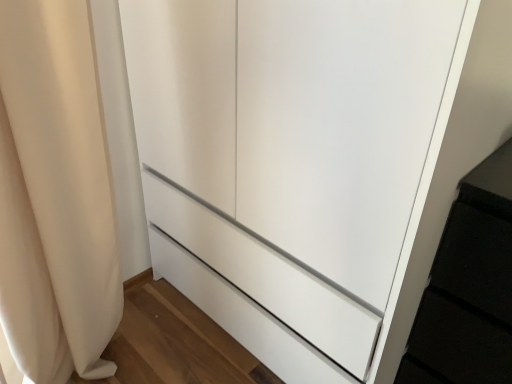
Question: Should I look upward or downward to see white glossy cupboard at center?

Choices:
 (A) down
 (B) up

Answer: (B)

Question: Does beige fabric curtain at left lie behind white glossy cupboard at center?

Choices:
 (A) no
 (B) yes

Answer: (B)

Question: Is beige fabric curtain at left located outside white glossy cupboard at center?

Choices:
 (A) no
 (B) yes

Answer: (B)

Question: Is beige fabric curtain at left at the left side of white glossy cupboard at center?

Choices:
 (A) no
 (B) yes

Answer: (B)

Question: Is beige fabric curtain at left with white glossy cupboard at center?

Choices:
 (A) yes
 (B) no

Answer: (B)

Question: From the image's perspective, is beige fabric curtain at left on white glossy cupboard at center?

Choices:
 (A) no
 (B) yes

Answer: (A)

Question: Is beige fabric curtain at left aimed at white glossy cupboard at center?

Choices:
 (A) no
 (B) yes

Answer: (A)

Question: Are white glossy cupboard at center and beige fabric curtain at left making contact?

Choices:
 (A) no
 (B) yes

Answer: (A)

Question: From the image's perspective, is white glossy cupboard at center on beige fabric curtain at left?

Choices:
 (A) yes
 (B) no

Answer: (A)

Question: Does white glossy cupboard at center come in front of beige fabric curtain at left?

Choices:
 (A) yes
 (B) no

Answer: (A)

Question: Is white glossy cupboard at center bigger than beige fabric curtain at left?

Choices:
 (A) no
 (B) yes

Answer: (B)

Question: From the image's perspective, is white glossy cupboard at center under beige fabric curtain at left?

Choices:
 (A) yes
 (B) no

Answer: (B)

Question: Does white glossy cupboard at center appear on the left side of beige fabric curtain at left?

Choices:
 (A) yes
 (B) no

Answer: (B)

Question: From the image's perspective, relative to white glossy cupboard at center, is beige fabric curtain at left above or below?

Choices:
 (A) below
 (B) above

Answer: (A)